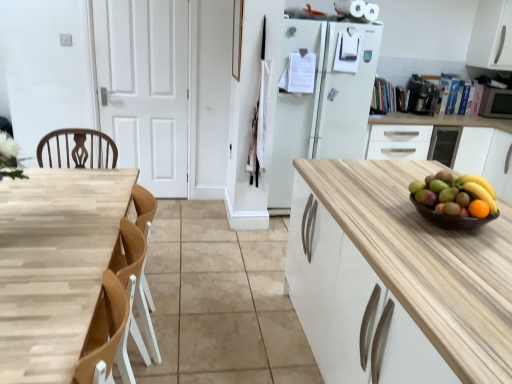
Question: Is white matte cabinet at right, the 2th cabinetry in the top-to-bottom sequence, taller or shorter than black plastic coffee maker at upper right, marked as the 2th appliance in a right-to-left arrangement?

Choices:
 (A) tall
 (B) short

Answer: (A)

Question: From a real-world perspective, is white matte cabinet at right, the 2th cabinetry in the top-to-bottom sequence, physically located above or below black plastic coffee maker at upper right, marked as the 2th appliance in a right-to-left arrangement?

Choices:
 (A) above
 (B) below

Answer: (B)

Question: Considering the real-world distances, which object is closest to the orange matte grapefruit at right?

Choices:
 (A) light wood table at left
 (B) white matte cabinet at right, acting as the first cabinetry starting from the bottom
 (C) matte brown bowl at right
 (D) black plastic coffee maker at upper right, marked as the 2th appliance in a right-to-left arrangement
 (E) metallic silver microwave at right, placed as the 2th appliance when sorted from left to right

Answer: (C)

Question: Estimate the real-world distances between objects in this image. Which object is farther from the matte brown bowl at right?

Choices:
 (A) white matte cabinet at right, the 2th cabinetry in the top-to-bottom sequence
 (B) white matte door at center
 (C) light wood table at left
 (D) white matte cabinet at upper right, the second cabinetry from the bottom
 (E) orange matte grapefruit at right

Answer: (D)